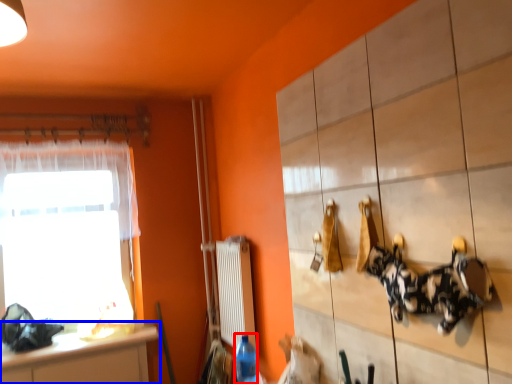
Question: Which of the following is the farthest to the observer, bottle (highlighted by a red box) or countertop (highlighted by a blue box)?

Choices:
 (A) bottle
 (B) countertop

Answer: (B)